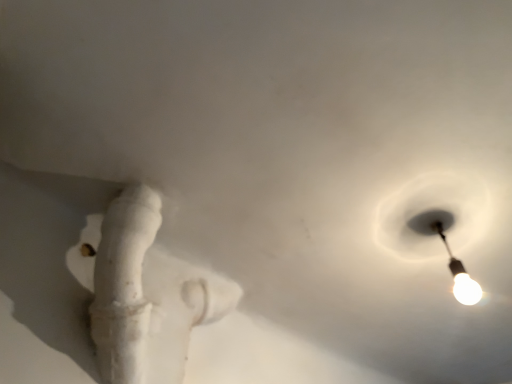
Where is `white glossy bulb at upper right`? This screenshot has height=384, width=512. white glossy bulb at upper right is located at coordinates (435, 224).

Describe the element at coordinates (435, 224) in the screenshot. I see `white glossy bulb at upper right` at that location.

Find the location of `white glossy bulb at upper right`. white glossy bulb at upper right is located at coordinates (435, 224).